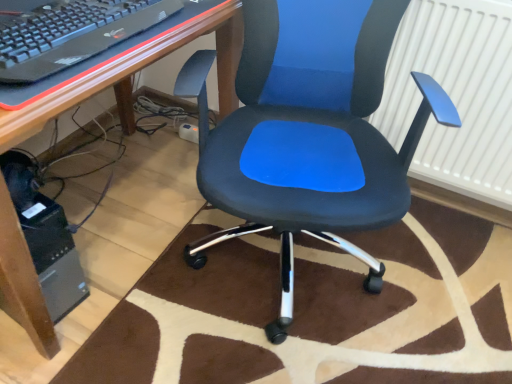
Identify the location of free point below matte black office chair at center (from a real-world perspective). The height and width of the screenshot is (384, 512). (283, 274).